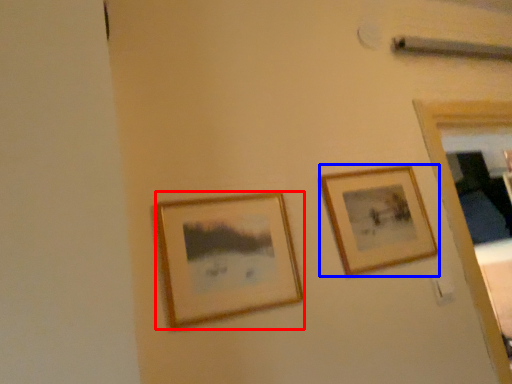
Question: Among these objects, which one is farthest to the camera, picture frame (highlighted by a red box) or picture frame (highlighted by a blue box)?

Choices:
 (A) picture frame
 (B) picture frame

Answer: (B)